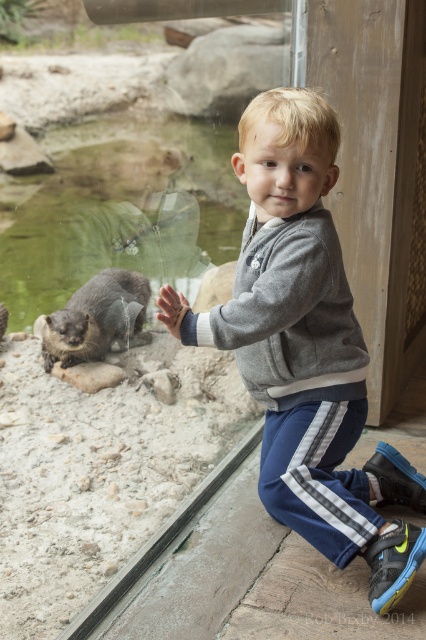
You are a zookeeper who needs to reach the otter enclosure quickly. You are currently standing 10 feet away from the transparent glass door at center. Can you reach the enclosure within 3 steps if each step covers 2 feet?

The transparent glass door at center is 5.70 feet away from you. Since each step covers 2 feet, 3 steps would cover 6 feet. Therefore, you can reach the enclosure within 3 steps as 6 feet is greater than 5.70 feet.

You are the child in the scene and want to touch the otter. The otter is at the edge of the enclosure. Can you reach it through the transparent glass door at center?

The transparent glass door at center is located at point (112, 365), so yes, you can reach the otter through the transparent glass door at center if it is positioned correctly between you and the otter.

You are the child in the image and you want to touch the otter. Can you reach it through the transparent glass door at center while wearing the gray heathered sweatshirt at center?

The transparent glass door at center is in front of the gray heathered sweatshirt at center, meaning the door is between you and the otter. Since the door is transparent, you can see the otter, but you cannot physically reach it through the glass. The gray heathered sweatshirt at center does not affect your ability to reach the otter, but the glass door blocks direct contact.